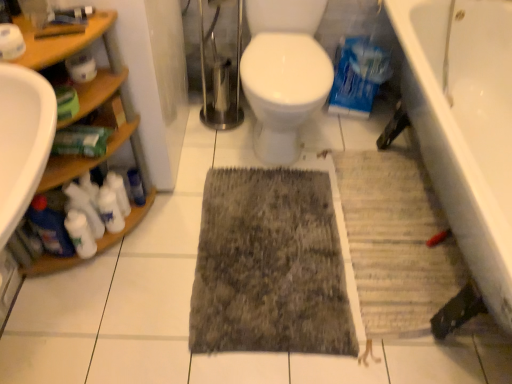
You are a GUI agent. You are given a task and a screenshot of the screen. Output one action in this format:
    pyautogui.click(x=<x>, y=<y>)
    Task: Click on the vacant space that is in between white matte cleaning products at lower left, which is the second cleaning product in right-to-left order, and dark gray textured rug at center
    
    Given the screenshot: What is the action you would take?
    pyautogui.click(x=170, y=244)